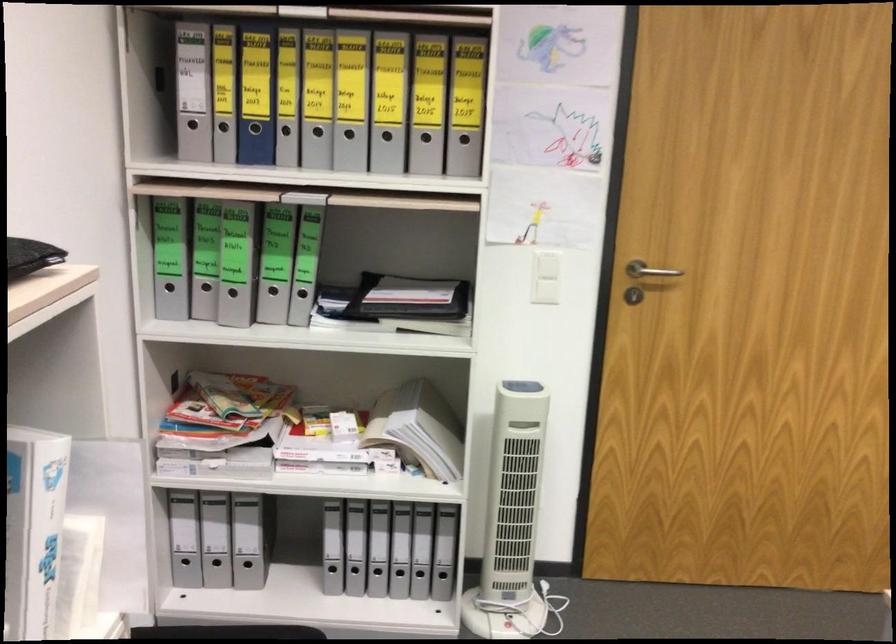
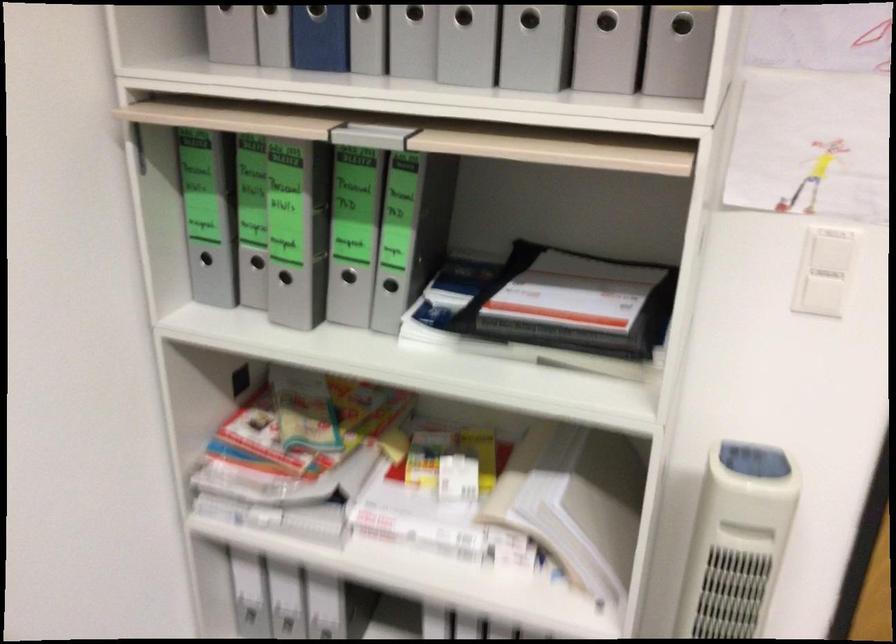
Where in the second image is the point corresponding to pixel 470 136 from the first image?

(682, 24)